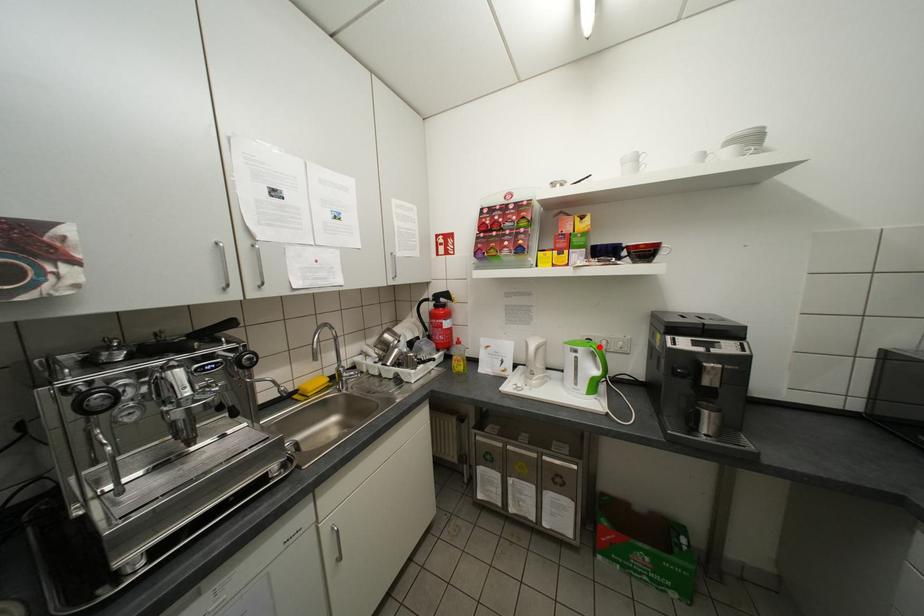
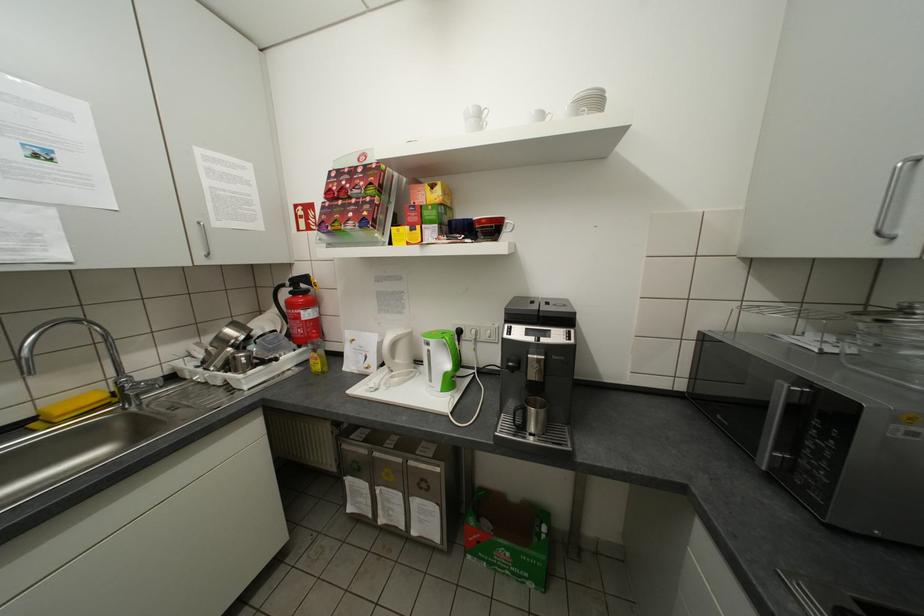
Where in the second image is the point corresponding to the highlighted location from the first image?

(452, 338)